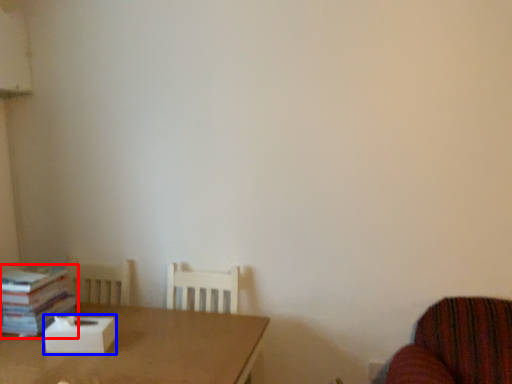
Question: Which object appears closest to the camera in this image, book (highlighted by a red box) or cardboard box (highlighted by a blue box)?

Choices:
 (A) book
 (B) cardboard box

Answer: (B)